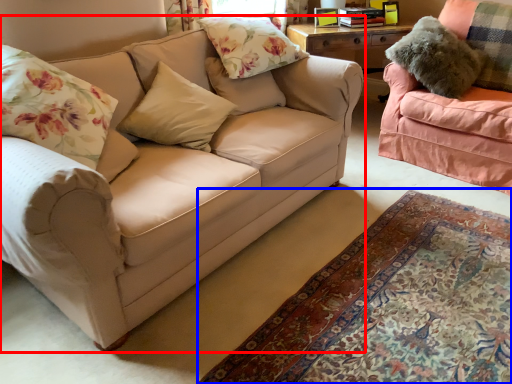
Question: Among these objects, which one is farthest to the camera, studio couch (highlighted by a red box) or plain (highlighted by a blue box)?

Choices:
 (A) studio couch
 (B) plain

Answer: (A)